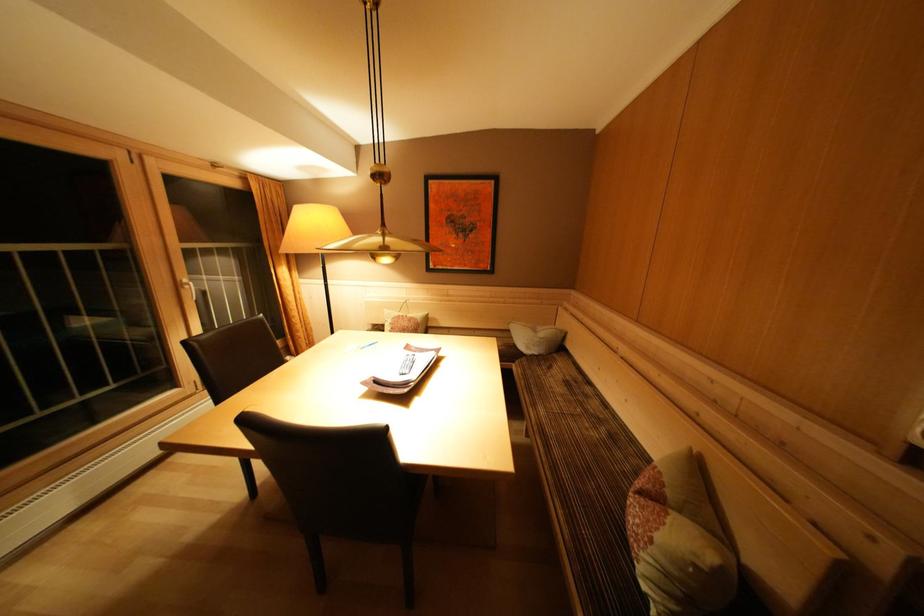
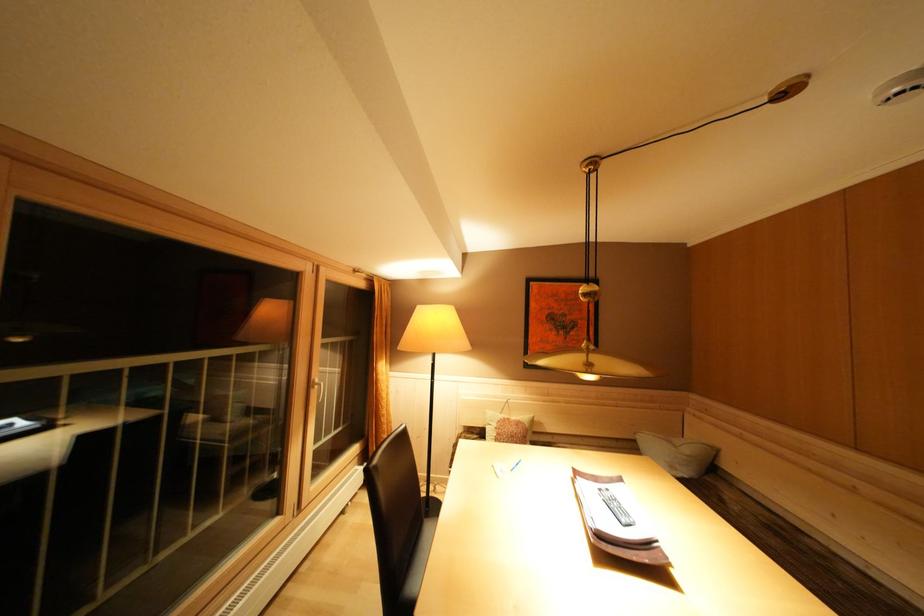
Find the pixel in the second image that matches the point at 409,321 in the first image.

(515, 424)